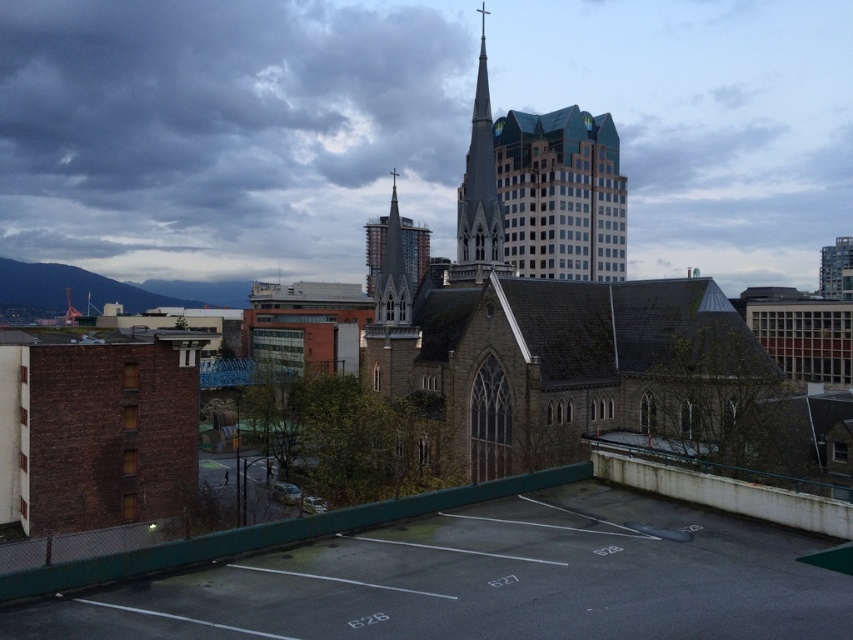
Describe the element at coordinates (227, 131) in the screenshot. I see `cloudy sky at upper center` at that location.

Who is more distant from viewer, (210, 140) or (322, 625)?

Positioned behind is point (210, 140).

Between point (297, 36) and point (645, 561), which one is positioned in front?

Point (645, 561) is in front.

Locate an element on the screen. The image size is (853, 640). cloudy sky at upper center is located at coordinates (227, 131).

Which is above, brown brick church at left or gray stone spire at center?

Positioned higher is gray stone spire at center.

Who is shorter, brown brick church at left or gray stone spire at center?

brown brick church at left

Which is behind, point (35, 465) or point (463, 243)?

The point (463, 243) is more distant.

Find the location of a particular element. The height and width of the screenshot is (640, 853). brown brick church at left is located at coordinates (96, 426).

Between dark gray asphalt parking lot at lower center and brown brick church at left, which one is positioned lower?

Positioned lower is dark gray asphalt parking lot at lower center.

Is dark gray asphalt parking lot at lower center taller than brown brick church at left?

Incorrect, dark gray asphalt parking lot at lower center's height is not larger of brown brick church at left's.

Identify the location of dark gray asphalt parking lot at lower center. (489, 580).